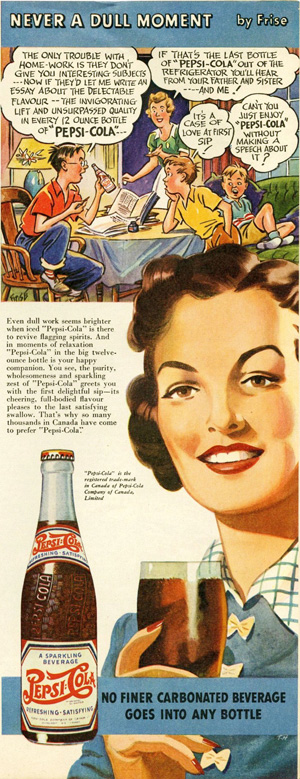
Where is `green sofa`? The height and width of the screenshot is (779, 300). green sofa is located at coordinates (286, 188).